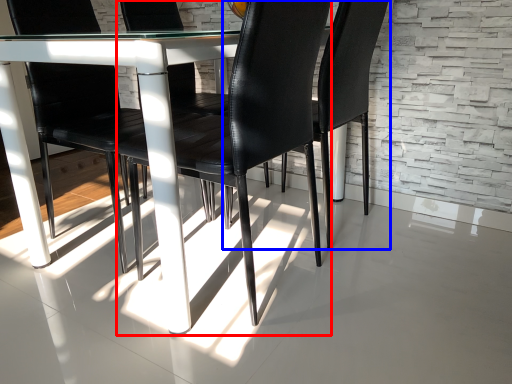
Question: Among these objects, which one is farthest to the camera, chair (highlighted by a red box) or chair (highlighted by a blue box)?

Choices:
 (A) chair
 (B) chair

Answer: (B)